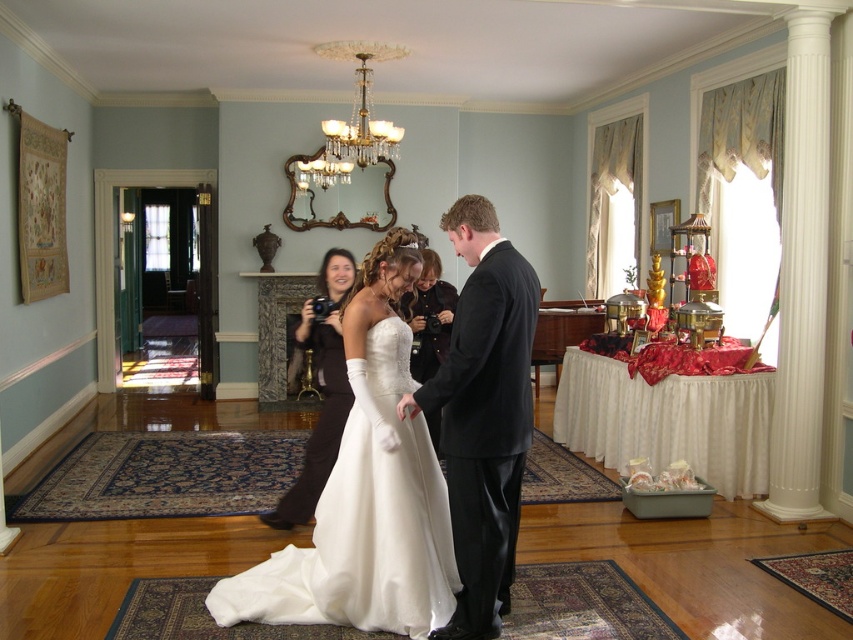
Question: Can you confirm if shiny black suit at center is positioned to the left of matte black camera at center?

Choices:
 (A) no
 (B) yes

Answer: (A)

Question: Does white satin dress at center appear on the right side of shiny black suit at center?

Choices:
 (A) yes
 (B) no

Answer: (B)

Question: Which object is farther from the camera taking this photo?

Choices:
 (A) crystal glass chandelier at upper center
 (B) shiny black suit at center
 (C) white satin dress at center
 (D) matte black camera at center

Answer: (A)

Question: In this image, where is white satin dress at center located relative to matte black camera at center?

Choices:
 (A) above
 (B) below

Answer: (B)

Question: Which point is closer to the camera taking this photo?

Choices:
 (A) (334, 349)
 (B) (490, 420)

Answer: (B)

Question: Estimate the real-world distances between objects in this image. Which object is farther from the shiny black suit at center?

Choices:
 (A) matte black camera at center
 (B) crystal glass chandelier at upper center

Answer: (B)